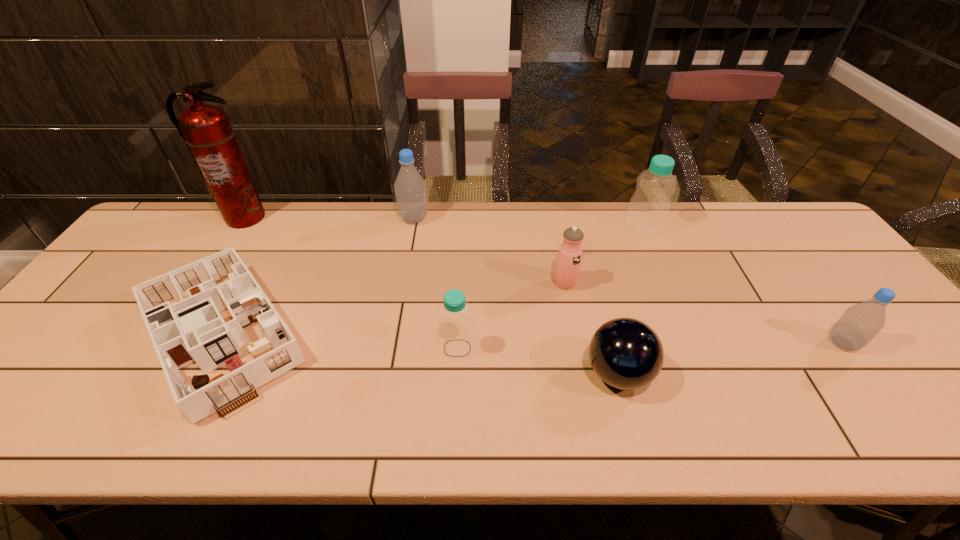
In the image, there is a desktop. Where is `free space at the left edge`? The height and width of the screenshot is (540, 960). free space at the left edge is located at coordinates [x=166, y=259].

I want to click on vacant space at the right edge of the desktop, so click(x=831, y=322).

The height and width of the screenshot is (540, 960). Identify the location of vacant region at the far left corner. (183, 221).

This screenshot has height=540, width=960. In the image, there is a desktop. In order to click on free space at the far right corner in this screenshot , I will do [780, 201].

At what (x,y) coordinates should I click in order to perform the action: click on free space between the shortest object and the farther blue bottle. Please return your answer as a coordinate pair (x, y). This screenshot has width=960, height=540. Looking at the image, I should click on tap(432, 279).

Identify the location of vacant space that is in between the fourth object from left to right and the farther gray bottle. The image size is (960, 540). (436, 284).

Locate an element on the screen. The width and height of the screenshot is (960, 540). vacant region between the thermos bottle and the smaller gray bottle is located at coordinates (704, 314).

This screenshot has height=540, width=960. I want to click on unoccupied area between the shortest object and the thermos bottle, so click(x=393, y=307).

The width and height of the screenshot is (960, 540). I want to click on empty space that is in between the second bottle from left to right and the shortest object, so click(x=339, y=339).

Where is `blank region between the rightmost bottle and the tallest object`? The image size is (960, 540). blank region between the rightmost bottle and the tallest object is located at coordinates (543, 280).